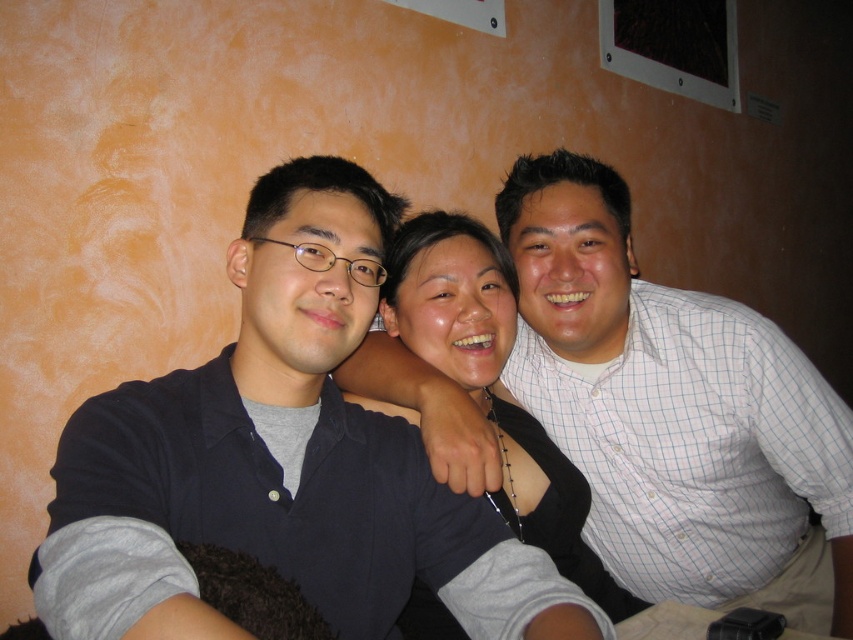
Question: Which of the following is the farthest from the observer?

Choices:
 (A) (405, 266)
 (B) (252, 401)

Answer: (A)

Question: Which object appears farthest from the camera in this image?

Choices:
 (A) dark blue shirt at center
 (B) matte black sweater at center

Answer: (B)

Question: Which object appears farthest from the camera in this image?

Choices:
 (A) dark blue shirt at center
 (B) matte black sweater at center

Answer: (B)

Question: Can you confirm if dark blue shirt at center is thinner than matte black sweater at center?

Choices:
 (A) no
 (B) yes

Answer: (A)

Question: Does dark blue shirt at center have a smaller size compared to matte black sweater at center?

Choices:
 (A) no
 (B) yes

Answer: (B)

Question: Observing the image, what is the correct spatial positioning of dark blue shirt at center in reference to matte black sweater at center?

Choices:
 (A) below
 (B) above

Answer: (B)